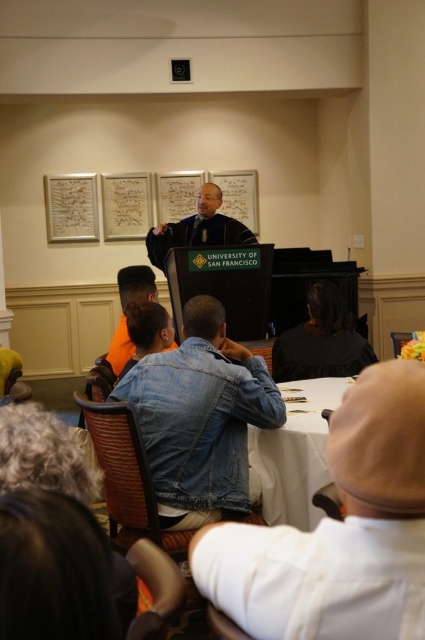
Question: Which of these objects is positioned farthest from the matte black podium at center?

Choices:
 (A) white glossy table at center
 (B) black fabric at center
 (C) denim jacket at center
 (D) denim jacket at lower right

Answer: (D)

Question: Which object appears closest to the camera in this image?

Choices:
 (A) denim jacket at lower right
 (B) denim jacket at center

Answer: (A)

Question: Which object is positioned farthest from the black fabric at center?

Choices:
 (A) denim jacket at center
 (B) denim jacket at lower right

Answer: (B)

Question: Does black fabric at center appear under orange fabric at center?

Choices:
 (A) no
 (B) yes

Answer: (B)

Question: In this image, where is white glossy table at center located relative to black fabric at center?

Choices:
 (A) right
 (B) left

Answer: (B)

Question: Does denim jacket at lower right come in front of orange fabric at center?

Choices:
 (A) no
 (B) yes

Answer: (B)